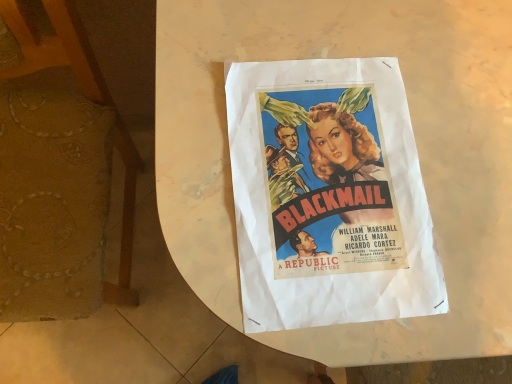
I want to click on vacant point above matte paper poster at center (from a real-world perspective), so click(x=332, y=176).